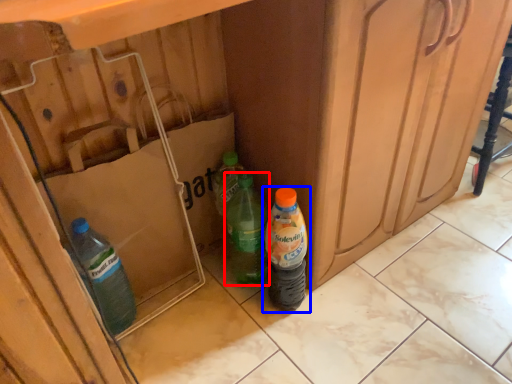
Question: Which point is closer to the camera, bottle (highlighted by a red box) or bottle (highlighted by a blue box)?

Choices:
 (A) bottle
 (B) bottle

Answer: (B)